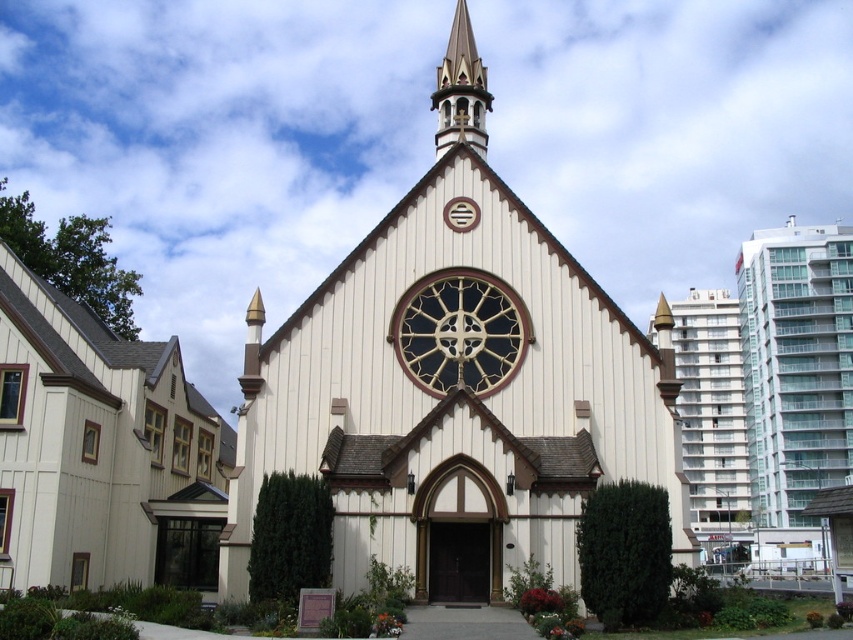
Question: Is white wood siding at left wider than dark stained glass clock at center?

Choices:
 (A) yes
 (B) no

Answer: (A)

Question: Does wooden chapel at center lie in front of polished wood spire at upper center?

Choices:
 (A) no
 (B) yes

Answer: (B)

Question: Estimate the real-world distances between objects in this image. Which object is closer to the polished wood spire at upper center?

Choices:
 (A) white glass building at right
 (B) dark stained glass clock at center
 (C) wooden chapel at center

Answer: (B)

Question: Based on their relative distances, which object is nearer to the glassy concrete building at right?

Choices:
 (A) white glass building at right
 (B) white wood siding at left
 (C) dark stained glass clock at center
 (D) wooden chapel at center

Answer: (A)

Question: Does white glass building at right lie behind dark stained glass clock at center?

Choices:
 (A) yes
 (B) no

Answer: (B)

Question: Which point is farther to the camera?

Choices:
 (A) (447, 124)
 (B) (810, 321)
 (C) (70, 390)

Answer: (B)